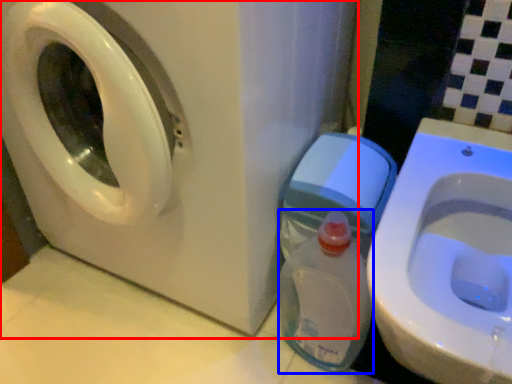
Question: Among these objects, which one is farthest to the camera, washing machine (highlighted by a red box) or baby bottle (highlighted by a blue box)?

Choices:
 (A) washing machine
 (B) baby bottle

Answer: (B)